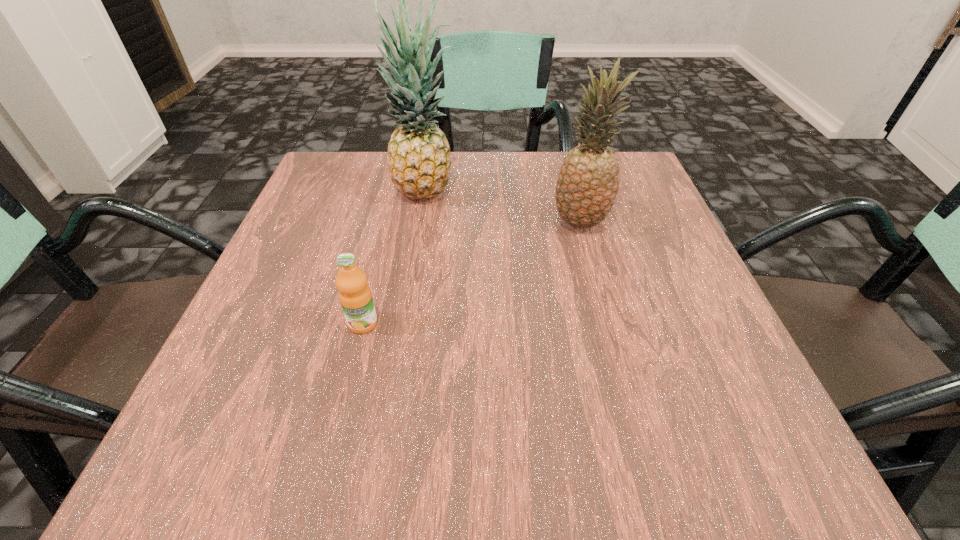
Where is `object at the far right corner`? object at the far right corner is located at coordinates (588, 182).

Locate an element on the screen. The height and width of the screenshot is (540, 960). vacant space at the far edge is located at coordinates (468, 177).

At what (x,y) coordinates should I click in order to perform the action: click on free space at the near edge of the desktop. Please return your answer as a coordinate pair (x, y). Looking at the image, I should click on (645, 469).

The width and height of the screenshot is (960, 540). Find the location of `vacant space at the left edge of the desktop`. vacant space at the left edge of the desktop is located at coordinates (353, 238).

At what (x,y) coordinates should I click in order to perform the action: click on vacant space at the right edge of the desktop. Please return your answer as a coordinate pair (x, y). Image resolution: width=960 pixels, height=540 pixels. Looking at the image, I should click on (704, 284).

Identify the location of free space at the near right corner of the desktop. This screenshot has width=960, height=540. (719, 465).

The height and width of the screenshot is (540, 960). Find the location of `vacant space that is in between the tallest object and the shorter pineapple`. vacant space that is in between the tallest object and the shorter pineapple is located at coordinates click(x=503, y=208).

At what (x,y) coordinates should I click in order to perform the action: click on empty space between the right pineapple and the left pineapple. Please return your answer as a coordinate pair (x, y). Image resolution: width=960 pixels, height=540 pixels. Looking at the image, I should click on (503, 208).

Identify the location of blank region between the nearest object and the tallest object. The image size is (960, 540). (395, 259).

This screenshot has height=540, width=960. Identify the location of free space between the second shortest object and the taller pineapple. point(503,208).